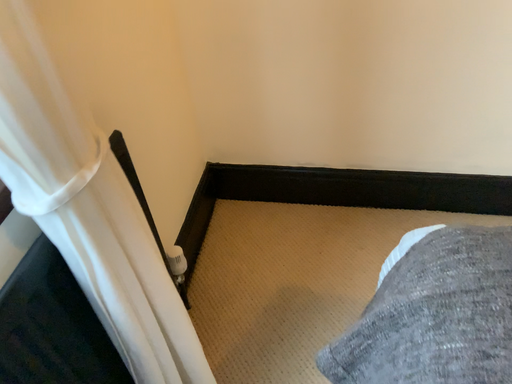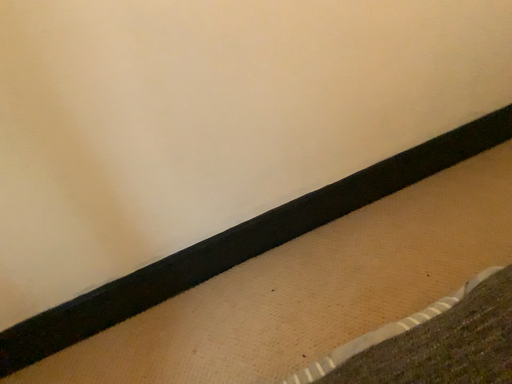
Question: How did the camera likely rotate when shooting the video?

Choices:
 (A) rotated left
 (B) rotated right

Answer: (B)